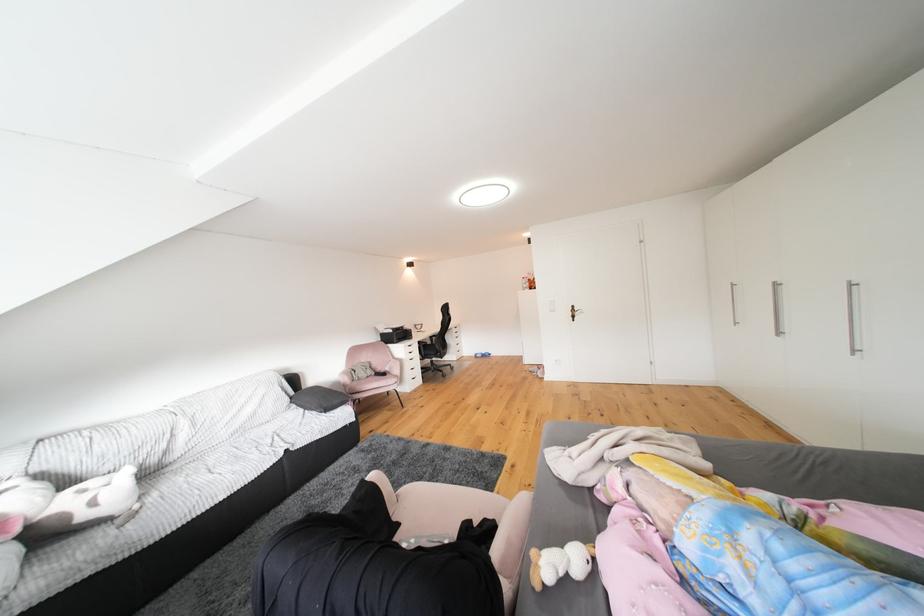
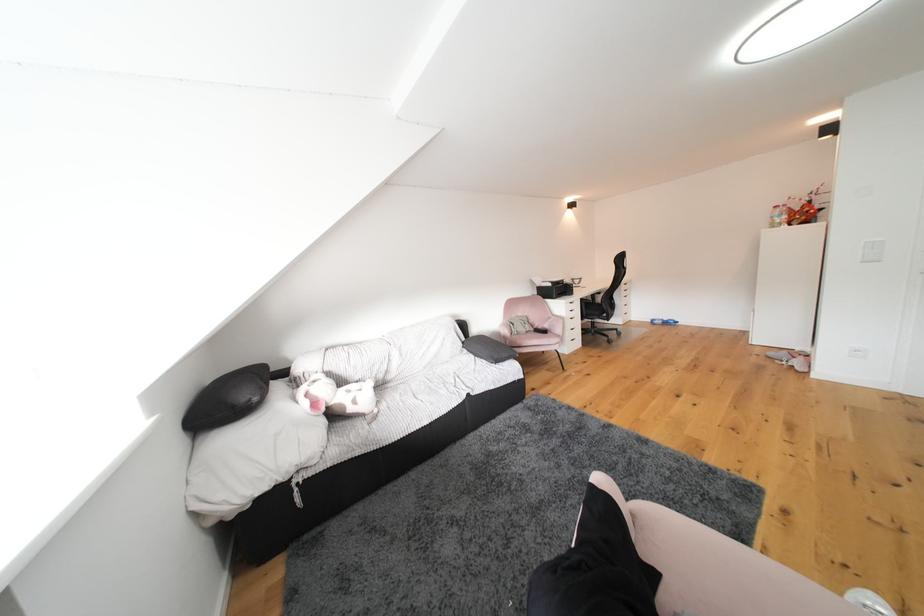
The point at (355, 383) is marked in the first image. Where is the corresponding point in the second image?

(515, 336)